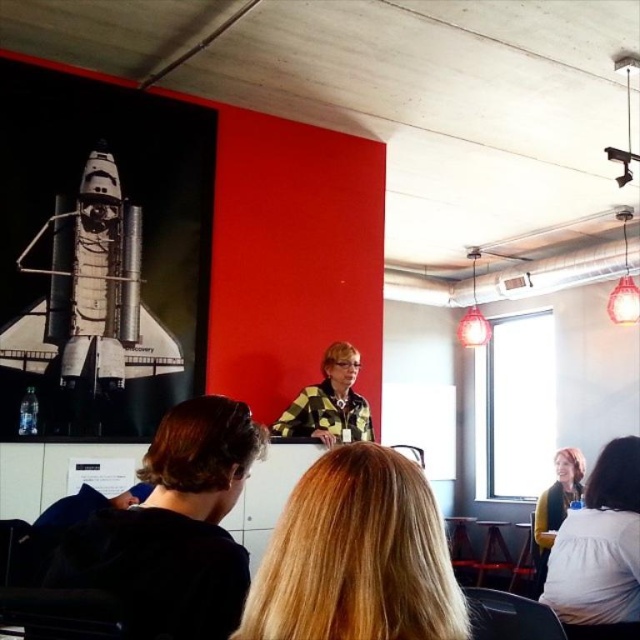
Is blonde hair at center bigger than metallic silver rocket at upper left?

No, blonde hair at center is not bigger than metallic silver rocket at upper left.

Is point (362, 540) closer to viewer compared to point (80, 198)?

Yes, point (362, 540) is closer to viewer.

Is point (442, 602) closer to camera compared to point (108, 168)?

That is True.

Find the location of a particular element. The height and width of the screenshot is (640, 640). blonde hair at center is located at coordinates (356, 556).

Can you confirm if blonde hair at center is taller than yellow checkered shirt at center?

No.

Is blonde hair at center shorter than yellow checkered shirt at center?

Yes.

You are a GUI agent. You are given a task and a screenshot of the screen. Output one action in this format:
    pyautogui.click(x=<x>, y=<y>)
    Task: Click on the blonde hair at center
    
    Given the screenshot: What is the action you would take?
    pyautogui.click(x=356, y=556)

Does point (390, 563) come closer to viewer compared to point (564, 570)?

Yes.

Between point (324, 593) and point (577, 532), which one is positioned behind?

Positioned behind is point (577, 532).

Who is more forward, [352,545] or [593,605]?

Point [352,545] is more forward.

Identify the location of blonde hair at center. Image resolution: width=640 pixels, height=640 pixels. (356, 556).